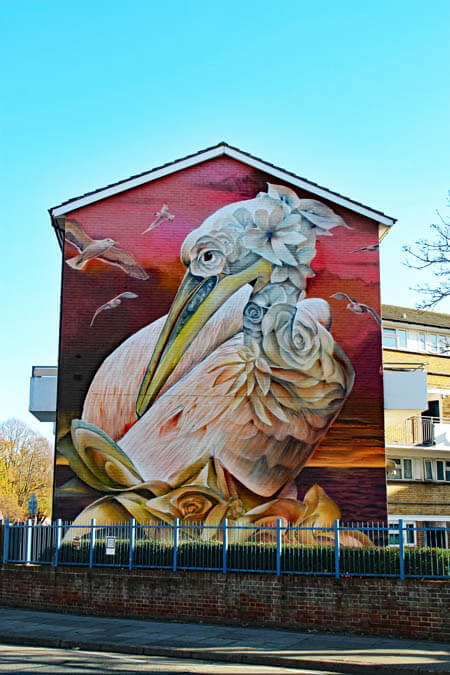
Find the location of a particular element. beige wall is located at coordinates 439,366.